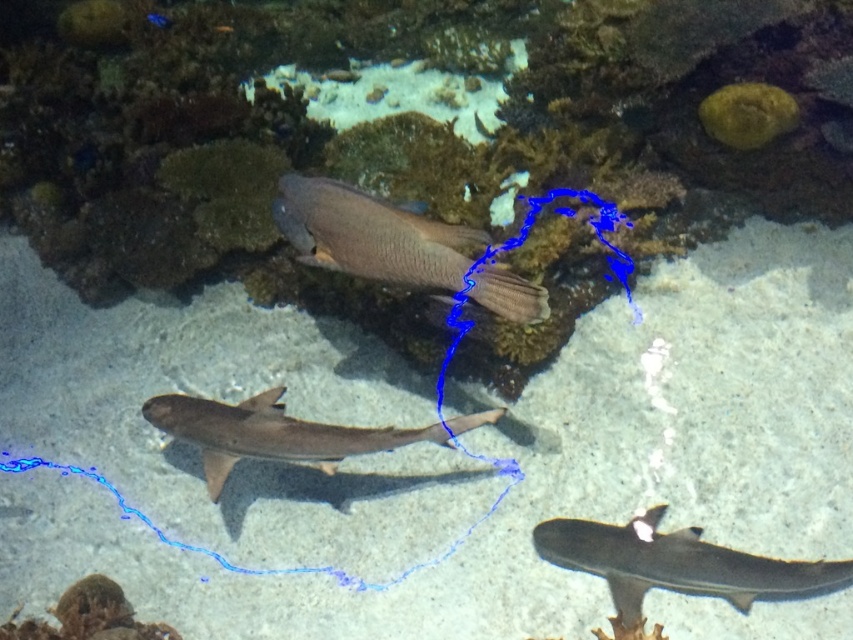
From the picture: You are a marine biologist observing the aquarium. You notice the matte brown fish at center and the smooth gray shark at center. Which one is closer to the viewing glass?

The matte brown fish at center is closer to the viewing glass because it is positioned in front of the smooth gray shark at center.

You are an underwater photographer aiming to capture a photo of both the smooth gray shark at lower right and the smooth gray shark at center. Since you want to include both in the frame, which shark should you position closer to the camera to ensure both fit in the shot?

The smooth gray shark at lower right is shorter than the smooth gray shark at center. To include both in the frame, position the shorter smooth gray shark at lower right closer to the camera so that its smaller size balances with the larger shark in the background.

You are an underwater photographer aiming to capture a photo of both the smooth gray shark at lower right and the smooth gray shark at center. Since you want both sharks in the frame, which shark should you position your camera closer to?

You should position your camera closer to the smooth gray shark at center because the smooth gray shark at lower right is positioned on the right side of it, so centering the camera on the shark at center will keep both sharks within the frame.